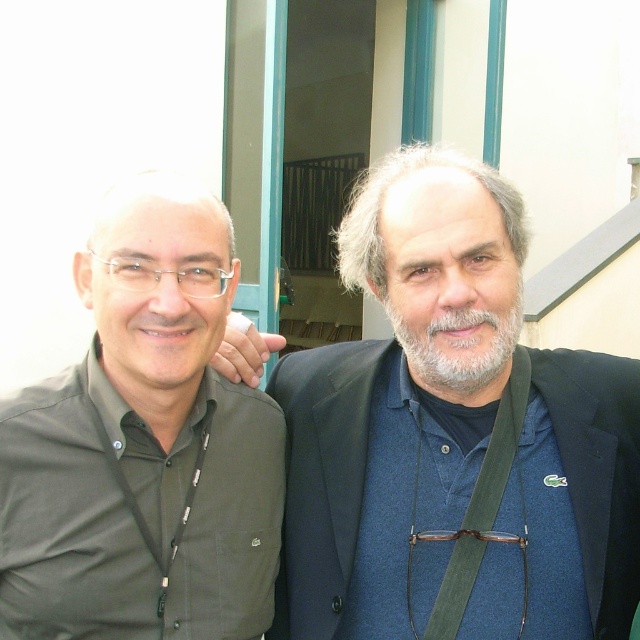
You are a photographer standing behind the two people in the image. You want to take a photo where both the green matte shirt at left and the grayhairbeard at center are clearly visible. However, you notice that one of them is blocking the other. Which person is closer to the camera and might be blocking the other?

The green matte shirt at left is closer to the viewer than the grayhairbeard at center, so the green matte shirt at left might be blocking the grayhairbeard at center in the photo.